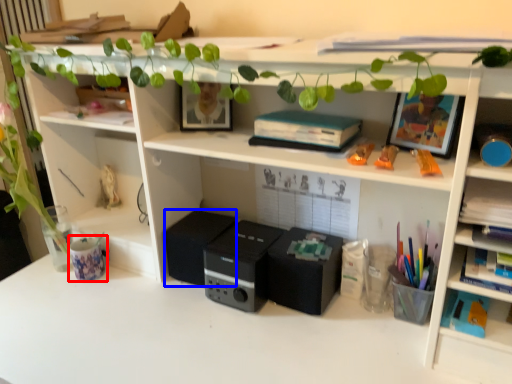
Question: Which point is further to the camera, stationery (highlighted by a red box) or speaker (highlighted by a blue box)?

Choices:
 (A) stationery
 (B) speaker

Answer: (A)